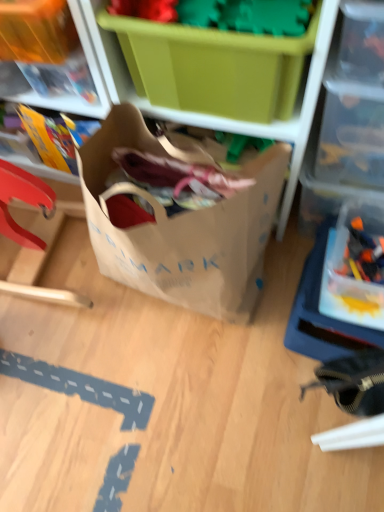
Where is `vacant area situated below transparent plastic storage box at right, which appears as the 3th storage box when viewed from the left (from a real-world perspective)`? vacant area situated below transparent plastic storage box at right, which appears as the 3th storage box when viewed from the left (from a real-world perspective) is located at coordinates (334, 294).